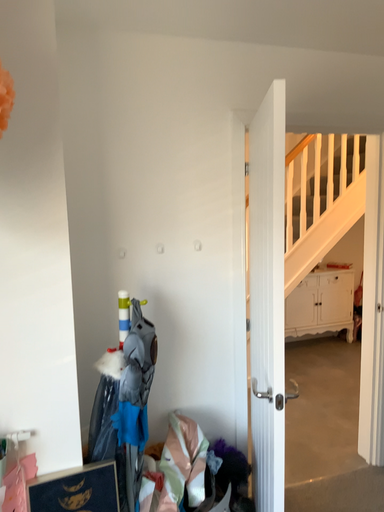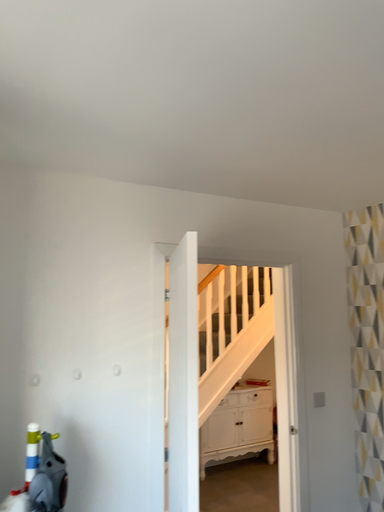
Question: Which way did the camera rotate in the video?

Choices:
 (A) rotated upward
 (B) rotated downward

Answer: (A)